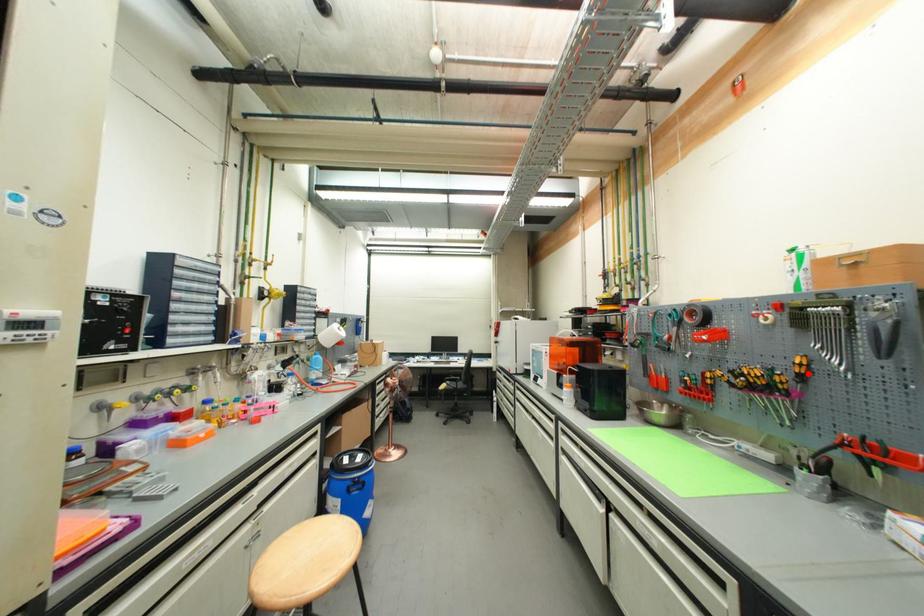
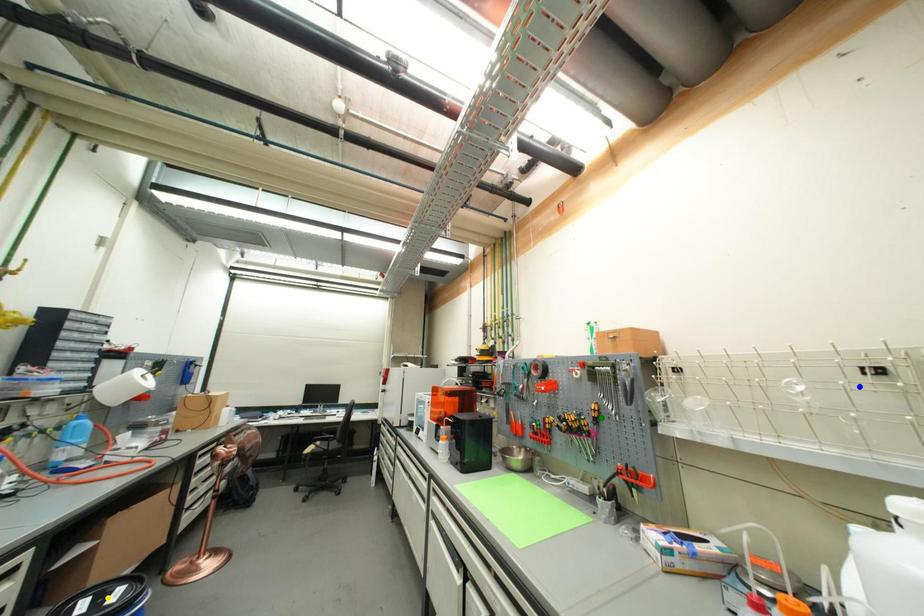
Question: I am providing you with two images of the same scene from different viewpoints. A red point is marked on the first image. You are given multiple points on the second image. In image 2, which mark is for the same physical point as the one in image 1?

Choices:
 (A) green point
 (B) blue point
 (C) yellow point

Answer: (A)